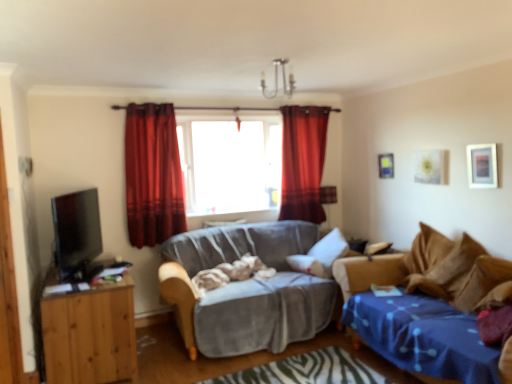
Question: From the image's perspective, is velvet red curtain at center, which is the 1th curtain from front to back, under velvet gray couch at center, placed as the first studio couch when sorted from left to right?

Choices:
 (A) yes
 (B) no

Answer: (B)

Question: Would you consider velvet red curtain at center, which is the 1th curtain from front to back, to be distant from velvet gray couch at center, placed as the first studio couch when sorted from left to right?

Choices:
 (A) yes
 (B) no

Answer: (B)

Question: Is velvet red curtain at center, marked as the 1th curtain in a left-to-right arrangement, positioned with its back to velvet gray couch at center, placed as the first studio couch when sorted from left to right?

Choices:
 (A) yes
 (B) no

Answer: (B)

Question: Is the position of velvet red curtain at center, which is the 1th curtain from front to back, more distant than that of velvet gray couch at center, placed as the 2th studio couch when sorted from right to left?

Choices:
 (A) yes
 (B) no

Answer: (A)

Question: From a real-world perspective, is velvet red curtain at center, the 2th curtain in the back-to-front sequence, on top of velvet gray couch at center, placed as the first studio couch when sorted from left to right?

Choices:
 (A) no
 (B) yes

Answer: (B)

Question: Can you confirm if velvet red curtain at center, the 2th curtain in the back-to-front sequence, is taller than velvet gray couch at center, placed as the 2th studio couch when sorted from right to left?

Choices:
 (A) yes
 (B) no

Answer: (A)

Question: Considering the relative positions of transparent glass window at center and black glossy tv at left in the image provided, is transparent glass window at center to the right of black glossy tv at left from the viewer's perspective?

Choices:
 (A) no
 (B) yes

Answer: (B)

Question: Can you confirm if transparent glass window at center is positioned to the left of black glossy tv at left?

Choices:
 (A) no
 (B) yes

Answer: (A)

Question: Considering the relative sizes of transparent glass window at center and black glossy tv at left in the image provided, is transparent glass window at center thinner than black glossy tv at left?

Choices:
 (A) yes
 (B) no

Answer: (B)

Question: Can you confirm if transparent glass window at center is shorter than black glossy tv at left?

Choices:
 (A) yes
 (B) no

Answer: (B)

Question: From a real-world perspective, is transparent glass window at center on black glossy tv at left?

Choices:
 (A) no
 (B) yes

Answer: (B)

Question: Can you confirm if transparent glass window at center is wider than black glossy tv at left?

Choices:
 (A) yes
 (B) no

Answer: (A)

Question: From the image's perspective, is transparent glass window at center located above velvet red curtain at center, the 2th curtain in the back-to-front sequence?

Choices:
 (A) no
 (B) yes

Answer: (B)